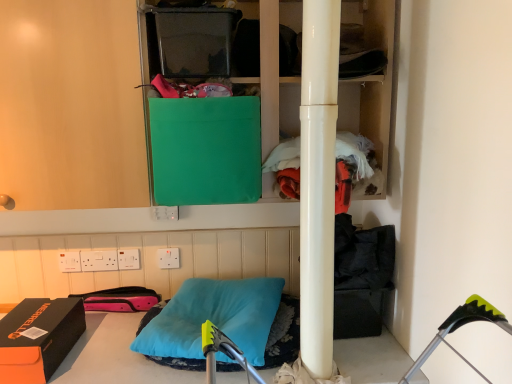
In order to click on vacant area on top of orange matte shoebox at lower left, which is counted as the 1th box, starting from the bottom (from a real-world perspective) in this screenshot , I will do `click(32, 322)`.